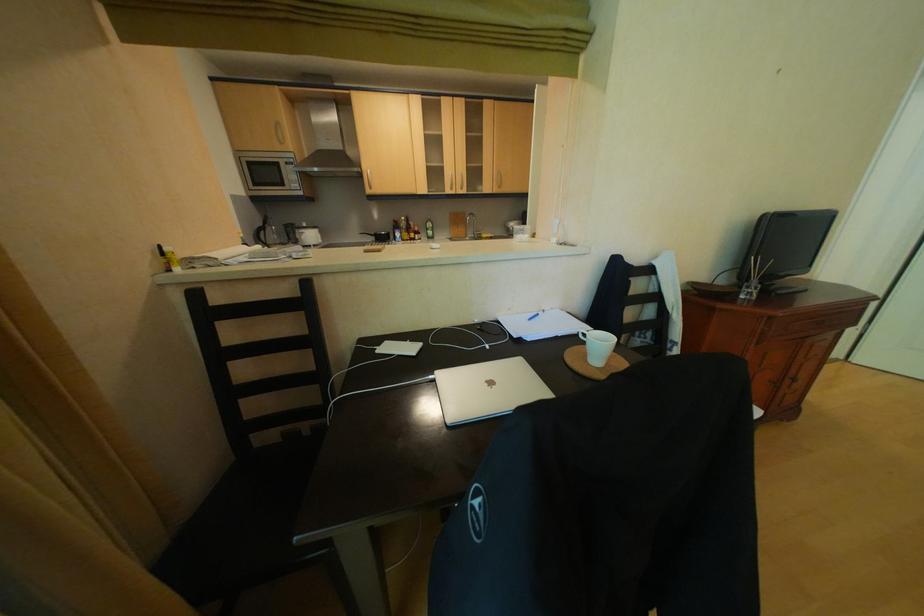
This screenshot has height=616, width=924. What are the coordinates of `faucet handle` in the screenshot? It's located at (470, 225).